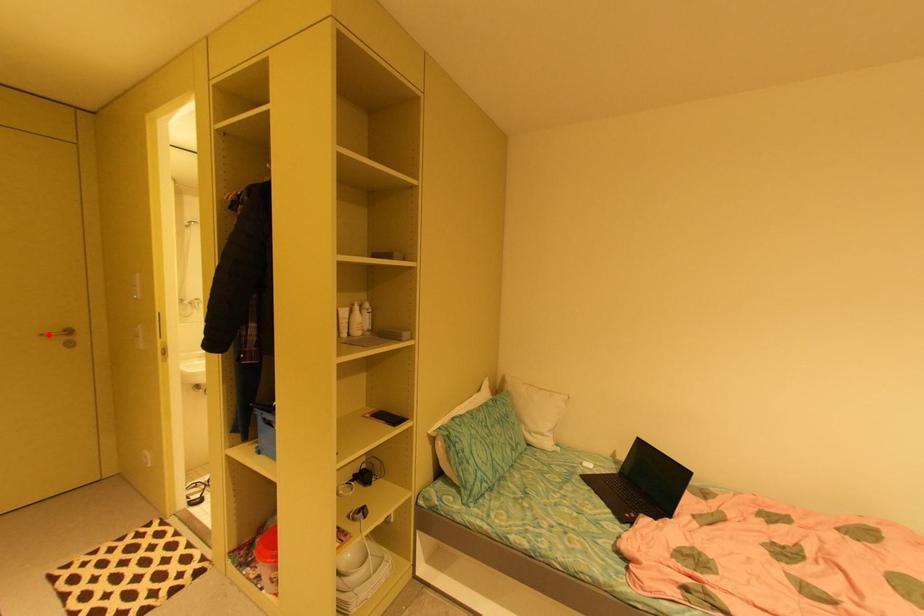
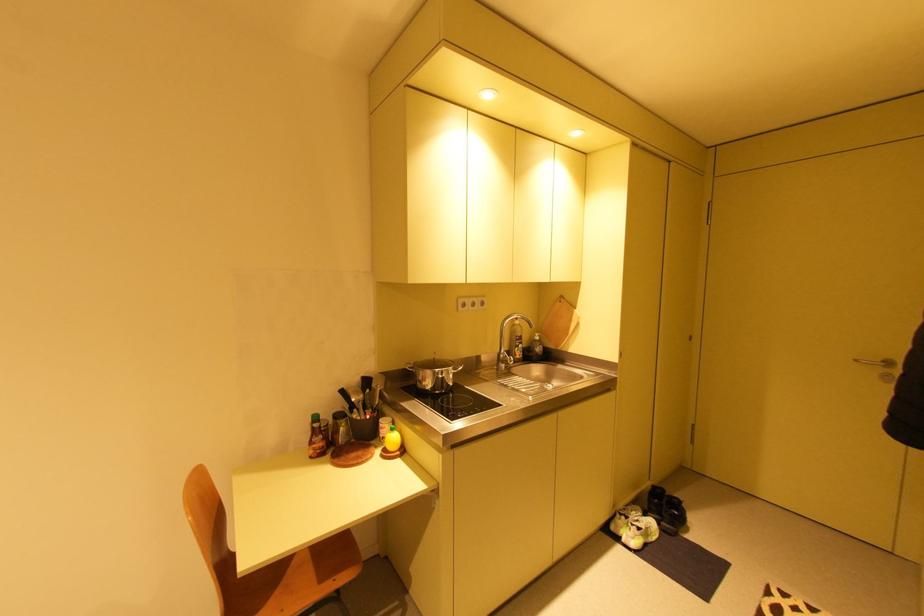
Question: I am providing you with two images of the same scene from different viewpoints. In image1, a red point is highlighted. Considering the same 3D point in image2, which of the following is correct?

Choices:
 (A) It is closer
 (B) It is farther

Answer: (B)